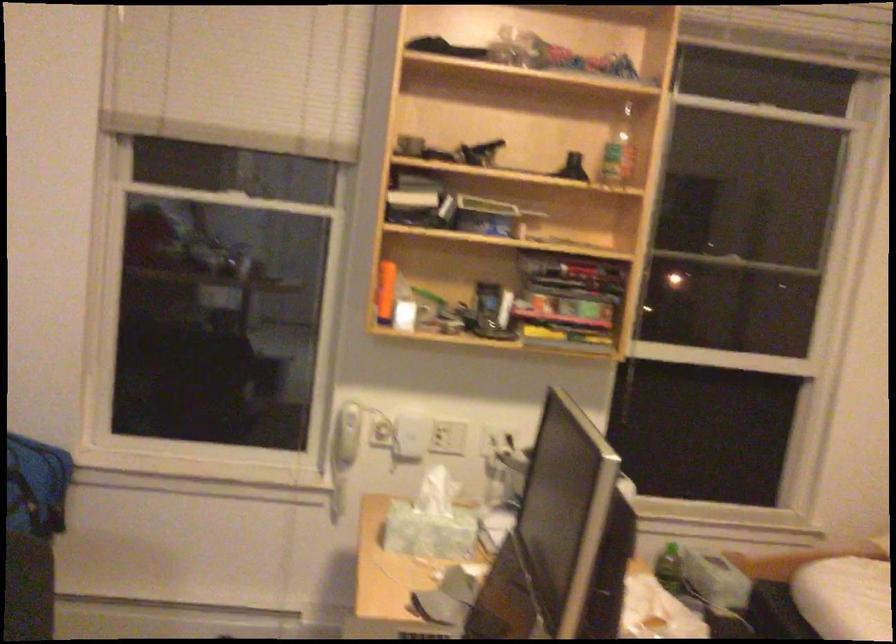
Find where to lift the white phone handset. Please return your answer as a coordinate pair (x, y).

(349, 418)